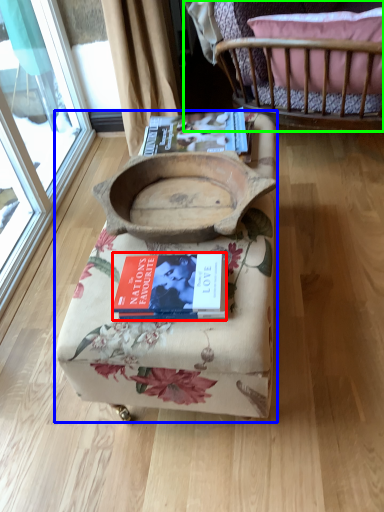
Question: Which is nearer to the book (highlighted by a red box)? furniture (highlighted by a blue box) or furniture (highlighted by a green box).

Choices:
 (A) furniture
 (B) furniture

Answer: (A)